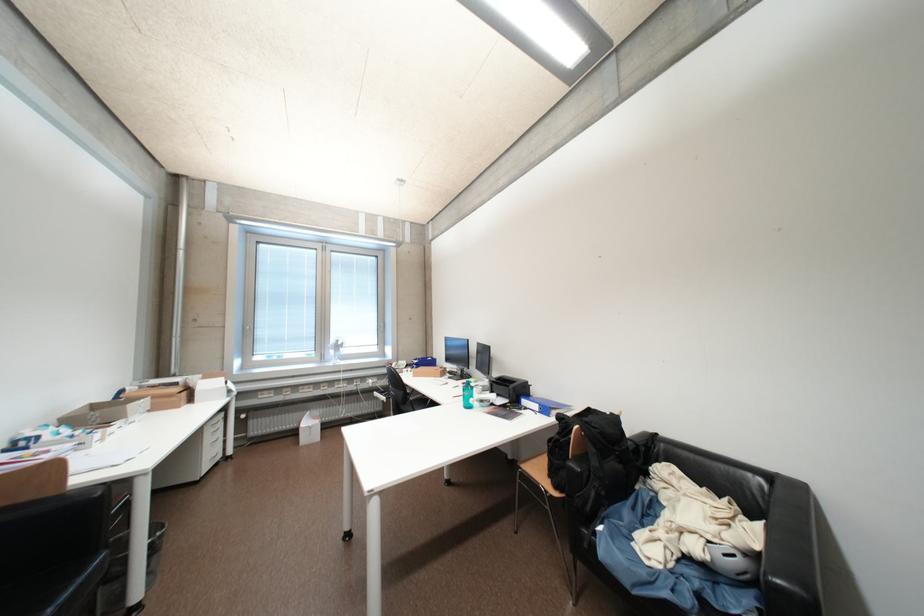
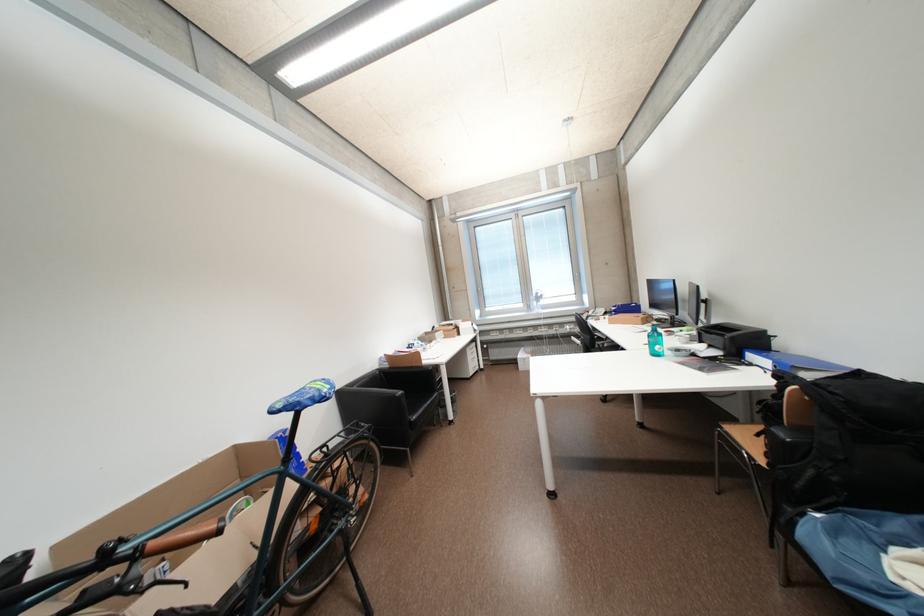
In the second image, find the point that corresponds to the point at 602,430 in the first image.

(841, 395)